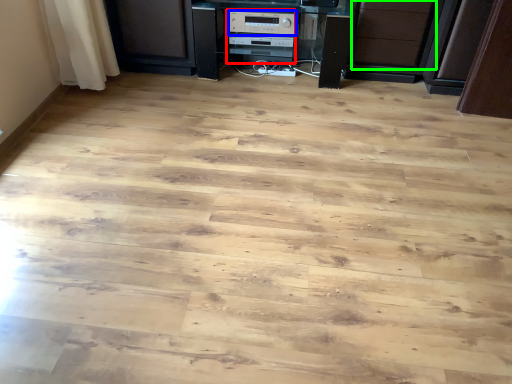
Question: Considering the real-world distances, which object is closest to appliance (highlighted by a red box)? appliance (highlighted by a blue box) or drawer (highlighted by a green box).

Choices:
 (A) appliance
 (B) drawer

Answer: (A)